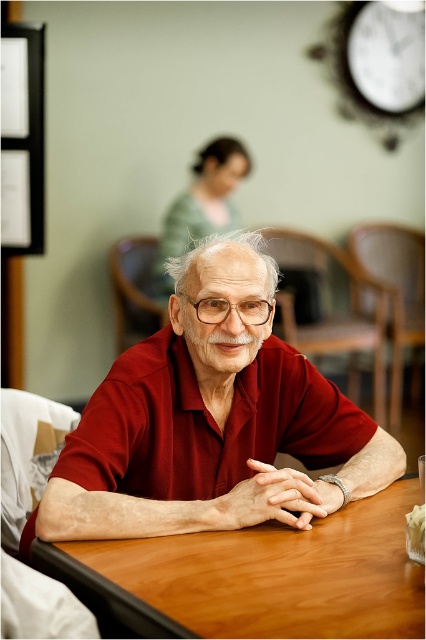
You are an interior designer planning to add a new painting to the wall in this space. You want the painting to be placed above the matte red shirt at center but below the matte green sweater at upper center. Is this possible based on their positions?

The matte red shirt at center is located below the matte green sweater at upper center, so placing a painting above the matte red shirt at center but below the matte green sweater at upper center is possible between their positions.

You are a photographer who wants to adjust the focus of your camera to ensure the matte red shirt at center is in focus. Based on the scene description, what is the 2D coordinate point you should aim for?

The matte red shirt at center is located at the 2D coordinate point of (212, 422), so you should aim for that point to ensure it is in focus.